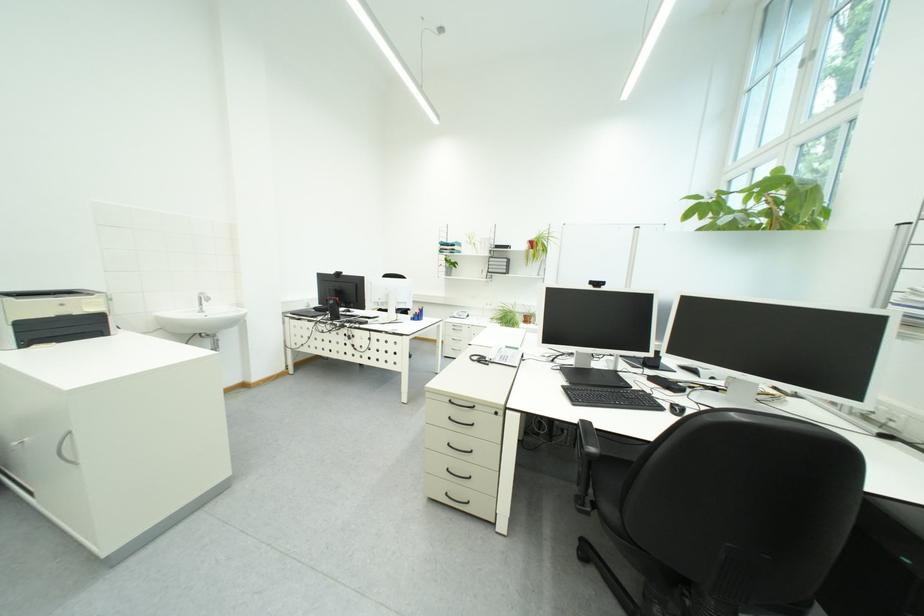
Image resolution: width=924 pixels, height=616 pixels. What are the coordinates of `telephone handset` in the screenshot? It's located at (493, 352).